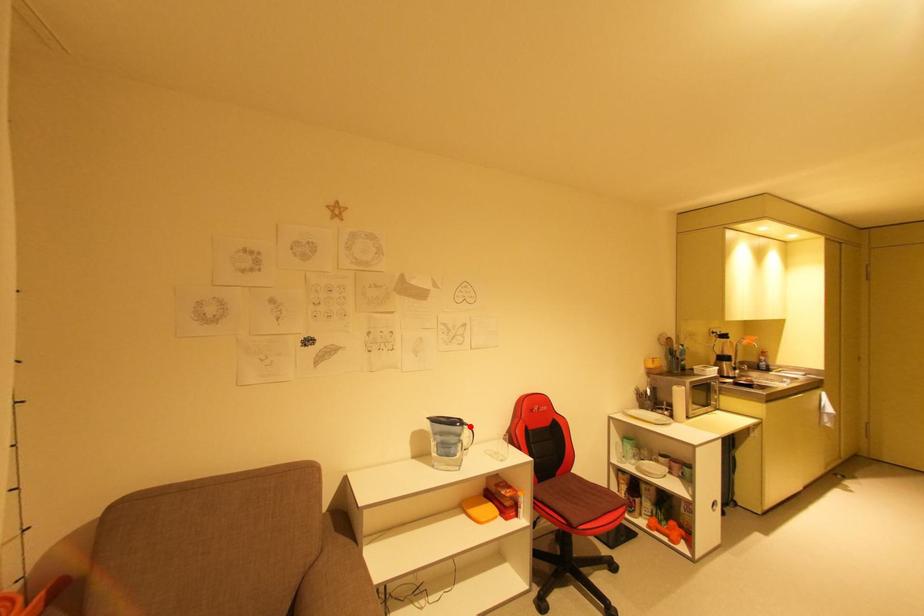
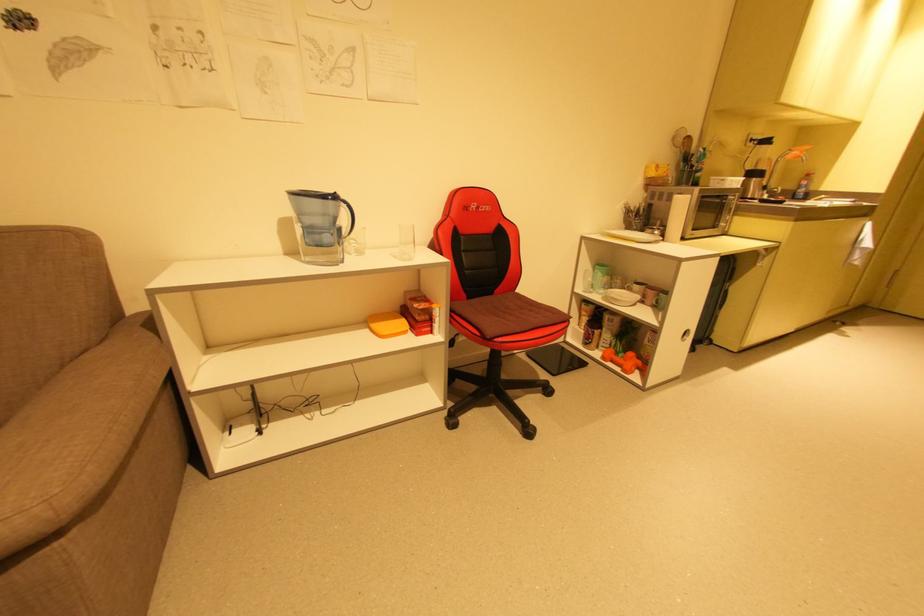
In the second image, find the point that corresponds to the highlighted location in the first image.

(346, 204)